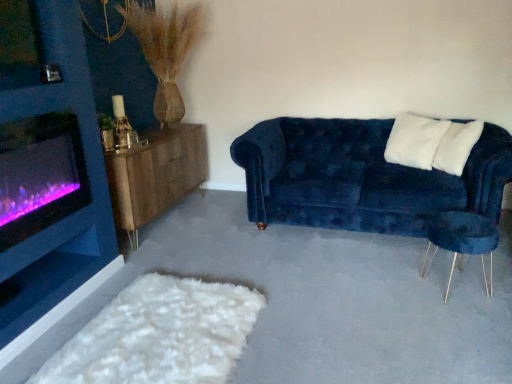
Image resolution: width=512 pixels, height=384 pixels. Find the location of `velvet blue couch at right`. velvet blue couch at right is located at coordinates (361, 177).

In order to face velvet blue couch at right, should I rotate leftwards or rightwards?

Turn right approximately 14.244 degrees to face it.

What is the approximate width of purple glass wood burning stove at left?

The width of purple glass wood burning stove at left is 4.70 inches.

What do you see at coordinates (414, 140) in the screenshot? The image size is (512, 384). I see `white soft pillow at upper right, the second pillow positioned from the right` at bounding box center [414, 140].

How much space does white fluffy pillow at upper right, the 1th pillow when ordered from right to left, occupy vertically?

48.13 centimeters.

The height and width of the screenshot is (384, 512). Find the location of `wooden sideboard at left`. wooden sideboard at left is located at coordinates (155, 175).

Choose the correct answer: Is velvet blue couch at right inside white fluffy pillow at upper right, marked as the 2th pillow in a left-to-right arrangement, or outside it?

velvet blue couch at right exists outside the volume of white fluffy pillow at upper right, marked as the 2th pillow in a left-to-right arrangement.

Is velvet blue couch at right bigger or smaller than white fluffy pillow at upper right, the 1th pillow when ordered from right to left?

Considering their sizes, velvet blue couch at right takes up more space than white fluffy pillow at upper right, the 1th pillow when ordered from right to left.

Does point (264, 179) appear closer or farther from the camera than point (461, 130)?

Point (264, 179) appears to be farther away from the viewer than point (461, 130).

From a real-world perspective, which object stands above the other?

In real-world perspective, white fluffy pillow at upper right, marked as the 2th pillow in a left-to-right arrangement, is above.

Can you confirm if velvet blue armchair at right is taller than velvet blue couch at right?

In fact, velvet blue armchair at right may be shorter than velvet blue couch at right.

Is velvet blue armchair at right surrounding velvet blue couch at right?

Definitely not — velvet blue couch at right is not inside velvet blue armchair at right.

Locate an element on the screen. studio couch below the purple glass wood burning stove at left (from a real-world perspective) is located at coordinates (361, 177).

Does purple glass wood burning stove at left appear on the left side of velvet blue couch at right?

Indeed, purple glass wood burning stove at left is positioned on the left side of velvet blue couch at right.

How much distance is there between purple glass wood burning stove at left and velvet blue couch at right?

1.56 meters.

Looking at their sizes, would you say purple glass wood burning stove at left is wider or thinner than velvet blue couch at right?

Clearly, purple glass wood burning stove at left has less width compared to velvet blue couch at right.

Would you say white soft pillow at upper right, the second pillow positioned from the right, is inside or outside velvet blue armchair at right?

white soft pillow at upper right, the second pillow positioned from the right, is outside velvet blue armchair at right.

Is white soft pillow at upper right, the second pillow positioned from the right, positioned far away from velvet blue armchair at right?

No, white soft pillow at upper right, the second pillow positioned from the right, is not far away from velvet blue armchair at right.

Is point (389, 135) closer to camera compared to point (482, 252)?

No, (389, 135) is further to viewer.

Is white soft pillow at upper right, the second pillow positioned from the right, turned away from velvet blue armchair at right?

No.

In the scene shown: Can you confirm if white fluffy pillow at upper right, the 1th pillow when ordered from right to left, is positioned to the left of white soft pillow at upper right, arranged as the 1th pillow when viewed from the left?

No.

Which is behind, point (448, 133) or point (407, 130)?

The point (407, 130) is farther from the camera.

Considering the sizes of white fluffy pillow at upper right, the 1th pillow when ordered from right to left, and white soft pillow at upper right, arranged as the 1th pillow when viewed from the left, in the image, is white fluffy pillow at upper right, the 1th pillow when ordered from right to left, taller or shorter than white soft pillow at upper right, arranged as the 1th pillow when viewed from the left,?

Considering their sizes, white fluffy pillow at upper right, the 1th pillow when ordered from right to left, has less height than white soft pillow at upper right, arranged as the 1th pillow when viewed from the left.

Find the location of `pillow below the white soft pillow at upper right, arranged as the 1th pillow when viewed from the left (from the image's perspective)`. pillow below the white soft pillow at upper right, arranged as the 1th pillow when viewed from the left (from the image's perspective) is located at coordinates (457, 146).

Based on the photo, is white fluffy pillow at upper right, the 1th pillow when ordered from right to left, not close to velvet blue couch at right?

They are positioned close to each other.

From a real-world perspective, count 1st pillows upward from the velvet blue couch at right and point to it. Please provide its 2D coordinates.

[(457, 146)]

From a real-world perspective, is white fluffy pillow at upper right, marked as the 2th pillow in a left-to-right arrangement, positioned under velvet blue couch at right based on gravity?

No.

Is white fluffy pillow at upper right, marked as the 2th pillow in a left-to-right arrangement, thinner than velvet blue couch at right?

Correct, the width of white fluffy pillow at upper right, marked as the 2th pillow in a left-to-right arrangement, is less than that of velvet blue couch at right.

Is white soft pillow at upper right, the second pillow positioned from the right, positioned far away from wooden sideboard at left?

white soft pillow at upper right, the second pillow positioned from the right, is far away from wooden sideboard at left.

Does white soft pillow at upper right, the second pillow positioned from the right, have a lesser height compared to wooden sideboard at left?

Yes.

Which object is further away from the camera taking this photo, white soft pillow at upper right, arranged as the 1th pillow when viewed from the left, or wooden sideboard at left?

wooden sideboard at left.

You are a GUI agent. You are given a task and a screenshot of the screen. Output one action in this format:
    pyautogui.click(x=<x>, y=<y>)
    Task: Click on the studio couch that is on the left side of white fluffy pillow at upper right, marked as the 2th pillow in a left-to-right arrangement
    
    Given the screenshot: What is the action you would take?
    pyautogui.click(x=361, y=177)

In order to click on studio couch behind the velvet blue armchair at right in this screenshot , I will do `click(361, 177)`.

Considering their positions, is white fluffy pillow at upper right, the 1th pillow when ordered from right to left, positioned closer to white soft pillow at upper right, the second pillow positioned from the right, than velvet blue couch at right?

white fluffy pillow at upper right, the 1th pillow when ordered from right to left, is closer to white soft pillow at upper right, the second pillow positioned from the right.

Looking at the image, which one is located closer to velvet blue armchair at right, wooden sideboard at left or white soft pillow at upper right, arranged as the 1th pillow when viewed from the left?

Based on the image, white soft pillow at upper right, arranged as the 1th pillow when viewed from the left, appears to be nearer to velvet blue armchair at right.

Which object lies further to the anchor point velvet blue couch at right, purple glass wood burning stove at left or white fluffy pillow at upper right, marked as the 2th pillow in a left-to-right arrangement?

Among the two, purple glass wood burning stove at left is located further to velvet blue couch at right.

Looking at the image, which one is located closer to velvet blue armchair at right, wooden sideboard at left or velvet blue couch at right?

Among the two, velvet blue couch at right is located nearer to velvet blue armchair at right.

When comparing their distances from purple glass wood burning stove at left, does white soft pillow at upper right, arranged as the 1th pillow when viewed from the left, or white fluffy pillow at upper right, the 1th pillow when ordered from right to left, seem further?

white fluffy pillow at upper right, the 1th pillow when ordered from right to left, is further to purple glass wood burning stove at left.

Looking at the image, which one is located further to white fluffy pillow at upper right, the 1th pillow when ordered from right to left, velvet blue couch at right or velvet blue armchair at right?

velvet blue armchair at right lies further to white fluffy pillow at upper right, the 1th pillow when ordered from right to left, than the other object.

Which object lies further to the anchor point wooden sideboard at left, white fluffy pillow at upper right, the 1th pillow when ordered from right to left, or purple glass wood burning stove at left?

white fluffy pillow at upper right, the 1th pillow when ordered from right to left, lies further to wooden sideboard at left than the other object.

Based on their spatial positions, is wooden sideboard at left or velvet blue armchair at right closer to velvet blue couch at right?

velvet blue armchair at right.

Identify the location of table located between purple glass wood burning stove at left and velvet blue armchair at right in the left-right direction. Image resolution: width=512 pixels, height=384 pixels. (155, 175).

Find the location of `studio couch between white soft pillow at upper right, arranged as the 1th pillow when viewed from the left, and velvet blue armchair at right from top to bottom`. studio couch between white soft pillow at upper right, arranged as the 1th pillow when viewed from the left, and velvet blue armchair at right from top to bottom is located at coordinates (361, 177).

Find the location of `table located between purple glass wood burning stove at left and velvet blue couch at right in the left-right direction`. table located between purple glass wood burning stove at left and velvet blue couch at right in the left-right direction is located at coordinates (155, 175).

Find the location of `table between purple glass wood burning stove at left and white fluffy pillow at upper right, marked as the 2th pillow in a left-to-right arrangement`. table between purple glass wood burning stove at left and white fluffy pillow at upper right, marked as the 2th pillow in a left-to-right arrangement is located at coordinates (155, 175).